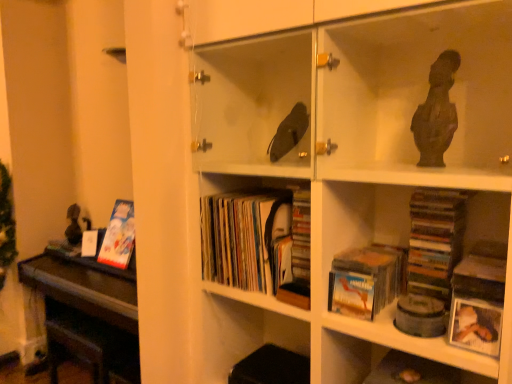
Question: Looking at their shapes, would you say white matte photo frame at lower right is wider or thinner than matte cardboard book at lower center, acting as the 1th book starting from the right?

Choices:
 (A) wide
 (B) thin

Answer: (B)

Question: Based on their positions, is white matte photo frame at lower right located to the left or right of matte cardboard book at lower center, acting as the 1th book starting from the right?

Choices:
 (A) right
 (B) left

Answer: (A)

Question: Which of these objects is positioned closest to the matte paper books at center, which is the second book from right to left?

Choices:
 (A) matte cardboard book at lower center, the third book viewed from the back
 (B) matte cardboard book at left, which is the 3th book from front to back
 (C) white matte photo frame at lower right
 (D) dark brown polished wood table at left

Answer: (A)

Question: Based on their relative distances, which object is nearer to the dark brown polished wood table at left?

Choices:
 (A) matte cardboard book at left, arranged as the first book when viewed from the back
 (B) matte cardboard book at lower center, the 1th book viewed from the front
 (C) matte paper books at center, the second book viewed from the front
 (D) white matte photo frame at lower right

Answer: (A)